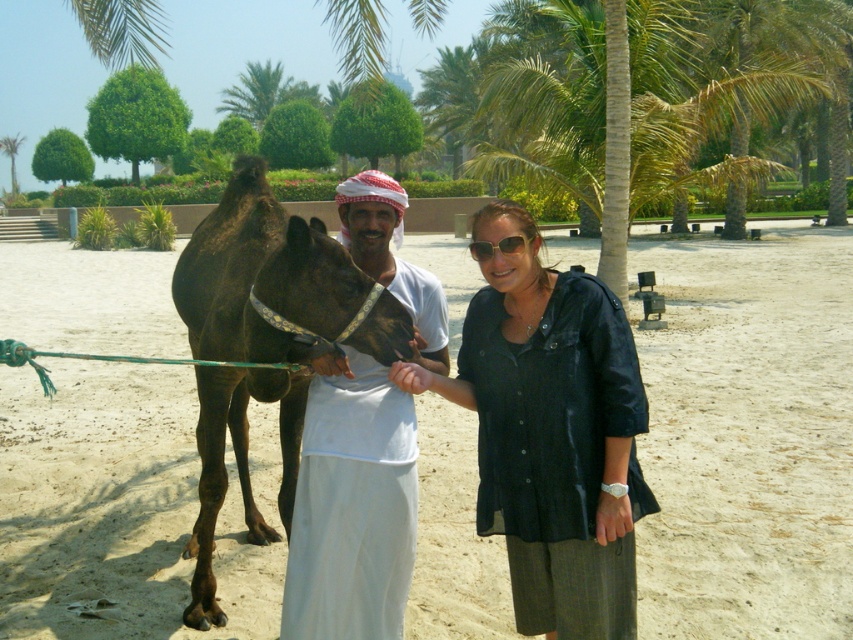
You are a drone operator trying to capture a photo of the man, woman, and camel in the sandy area. The green leafy palm tree at upper center is blocking part of the scene. To avoid the tree, should you adjust your drone to the left or right?

The green leafy palm tree at upper center is positioned at point (x=257, y=92), so you should adjust the drone to the right to avoid the tree blocking the scene.

You are standing in the sunny outdoor scene described. You see the brown sand at center and the white cotton shirt at center. Which object is positioned to the left of the other?

The brown sand at center is to the left of the white cotton shirt at center.